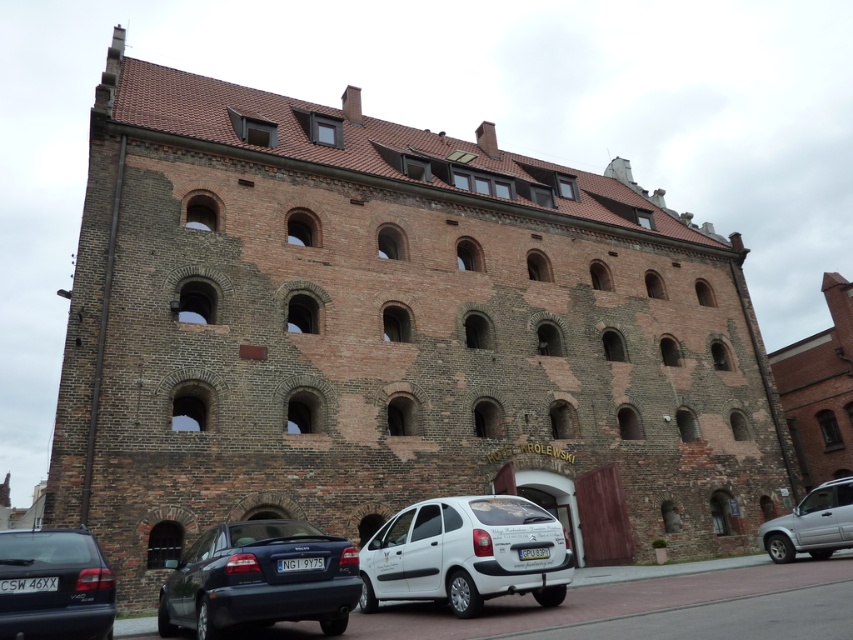
Question: Is white matte hatchback at center below matte black sedan at lower left?

Choices:
 (A) no
 (B) yes

Answer: (B)

Question: Does matte black car at lower left appear under silver metallic suv at lower right?

Choices:
 (A) yes
 (B) no

Answer: (B)

Question: Which point is closer to the camera?

Choices:
 (A) (223, 621)
 (B) (35, 604)
 (C) (393, 589)
 (D) (804, 529)

Answer: (B)

Question: Does white matte hatchback at center lie in front of matte black sedan at lower left?

Choices:
 (A) yes
 (B) no

Answer: (B)

Question: Which object appears farthest from the camera in this image?

Choices:
 (A) silver metallic suv at lower right
 (B) white matte hatchback at center
 (C) matte black sedan at lower left
 (D) matte black car at lower left

Answer: (A)

Question: Which of the following is the closest to the observer?

Choices:
 (A) (106, 634)
 (B) (460, 602)

Answer: (A)